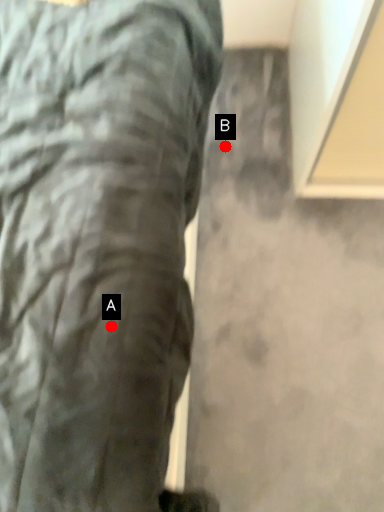
Question: Two points are circled on the image, labeled by A and B beside each circle. Among these points, which one is nearest to the camera?

Choices:
 (A) A is closer
 (B) B is closer

Answer: (A)